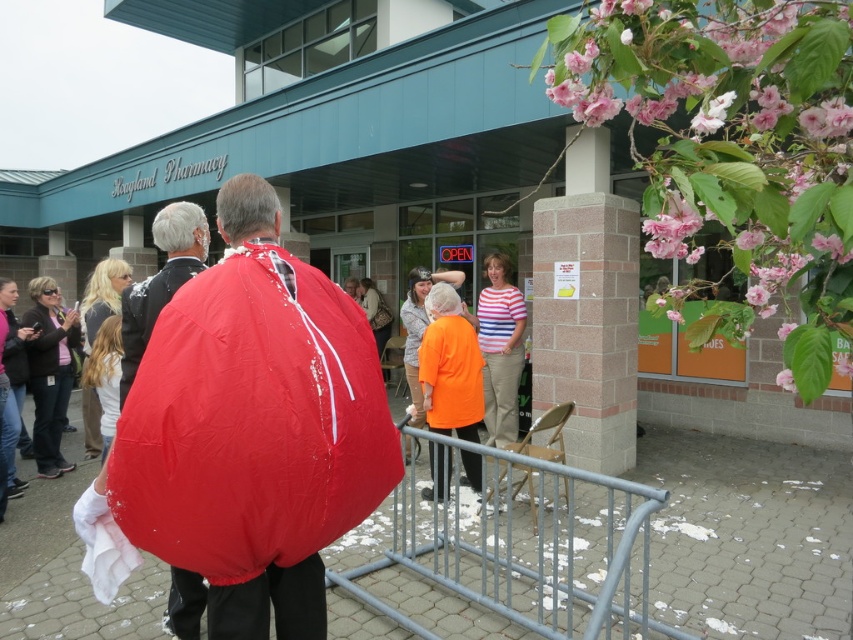
In the scene shown: You are a photographer standing at the entrance of Hogland Pharmacy. You need to capture a photo that includes both the matte red cape at center and the orange fabric jacket at center. Given that your camera has a maximum focus range of 7 feet, will you be able to include both subjects in the same frame without moving closer?

The distance between the matte red cape at center and the orange fabric jacket at center is 7.29 feet. Since your camera can only focus up to 7 feet, you will not be able to capture both subjects in the same frame without moving closer.

You are organizing a camping trip and have both the matte nylon sleeping bag at center and the orange fabric jacket at center. Which item takes up more space when stored?

The orange fabric jacket at center takes up more space than the matte nylon sleeping bag at center when stored because the matte nylon sleeping bag at center occupies less space than orange fabric jacket at center.

In the scene shown: You are standing at the entrance of Hogland Pharmacy and see the matte nylon sleeping bag at center and the striped fabric shirt at center. Which one is closer to you?

The matte nylon sleeping bag at center is closer to you because it is in front of the striped fabric shirt at center.